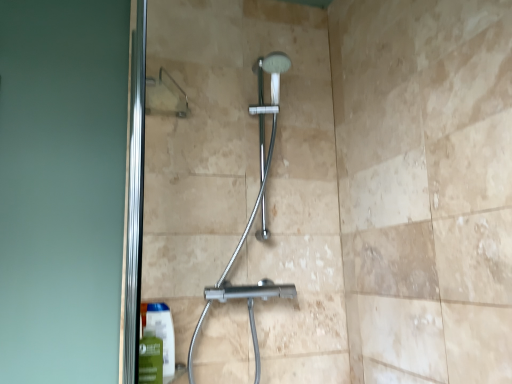
What do you see at coordinates (150, 358) in the screenshot? Image resolution: width=512 pixels, height=384 pixels. I see `green matte mouthwash at lower left` at bounding box center [150, 358].

Identify the location of transparent glass door at upper left. Image resolution: width=512 pixels, height=384 pixels. (246, 180).

Which of these two, green matte mouthwash at lower left or chrome metallic shower at center, stands taller?

chrome metallic shower at center.

From the image's perspective, which one is positioned higher, green matte mouthwash at lower left or chrome metallic shower at center?

From the image's view, chrome metallic shower at center is above.

Can we say green matte mouthwash at lower left lies outside chrome metallic shower at center?

Absolutely, green matte mouthwash at lower left is external to chrome metallic shower at center.

Considering the relative positions of green matte mouthwash at lower left and chrome metallic shower at center in the image provided, is green matte mouthwash at lower left to the left of chrome metallic shower at center from the viewer's perspective?

Indeed, green matte mouthwash at lower left is positioned on the left side of chrome metallic shower at center.

Is transparent glass door at upper left at the back of green matte mouthwash at lower left?

green matte mouthwash at lower left is not turned away from transparent glass door at upper left.

Considering the relative positions of green matte mouthwash at lower left and transparent glass door at upper left in the image provided, is green matte mouthwash at lower left in front of transparent glass door at upper left?

Yes, it is.

Considering the sizes of green matte mouthwash at lower left and transparent glass door at upper left in the image, is green matte mouthwash at lower left bigger or smaller than transparent glass door at upper left?

Considering their sizes, green matte mouthwash at lower left takes up less space than transparent glass door at upper left.

Can we say green matte mouthwash at lower left lies outside transparent glass door at upper left?

That's correct, green matte mouthwash at lower left is outside of transparent glass door at upper left.

Based on their positions, is transparent glass door at upper left located to the left or right of chrome metallic shower at center?

transparent glass door at upper left is positioned on chrome metallic shower at center's left side.

Is point (308, 226) closer to viewer compared to point (271, 61)?

No, (308, 226) is behind (271, 61).

From a real-world perspective, which is physically below, transparent glass door at upper left or chrome metallic shower at center?

In real-world perspective, chrome metallic shower at center is lower.

Is transparent glass door at upper left positioned with its back to chrome metallic shower at center?

Absolutely, transparent glass door at upper left is directed away from chrome metallic shower at center.

Based on the photo, is chrome metallic shower at center looking in the opposite direction of transparent glass door at upper left?

Yes, chrome metallic shower at center is facing away from transparent glass door at upper left.

Does chrome metallic shower at center have a lesser width compared to transparent glass door at upper left?

No, chrome metallic shower at center is not thinner than transparent glass door at upper left.

The height and width of the screenshot is (384, 512). Identify the location of glass door behind the chrome metallic shower at center. (246, 180).

Looking at this image, what's the angular difference between chrome metallic shower at center and transparent glass door at upper left's facing directions?

1.8 degrees separate the facing orientations of chrome metallic shower at center and transparent glass door at upper left.

Which is in front, transparent glass door at upper left or green matte mouthwash at lower left?

green matte mouthwash at lower left is in front.

Image resolution: width=512 pixels, height=384 pixels. What are the coordinates of `glass door that appears above the green matte mouthwash at lower left (from a real-world perspective)` in the screenshot? It's located at (246, 180).

From a real-world perspective, between transparent glass door at upper left and green matte mouthwash at lower left, who is vertically higher?

transparent glass door at upper left, from a real-world perspective.

Between transparent glass door at upper left and green matte mouthwash at lower left, which one has larger width?

green matte mouthwash at lower left.

Is point (261, 63) closer or farther from the camera than point (157, 351)?

Point (261, 63) is farther from the camera than point (157, 351).

Who is taller, chrome metallic shower at center or green matte mouthwash at lower left?

Standing taller between the two is chrome metallic shower at center.

Is chrome metallic shower at center smaller than green matte mouthwash at lower left?

No.

From a real-world perspective, between chrome metallic shower at center and green matte mouthwash at lower left, who is vertically lower?

In real-world perspective, green matte mouthwash at lower left is lower.

At what (x,y) coordinates should I click in order to perform the action: click on shower lying on the right of green matte mouthwash at lower left. Please return your answer as a coordinate pair (x, y). This screenshot has width=512, height=384. Looking at the image, I should click on (253, 215).

This screenshot has height=384, width=512. There is a green matte mouthwash at lower left. Find the location of `glass door above it (from a real-world perspective)`. glass door above it (from a real-world perspective) is located at coordinates (246, 180).

Based on their spatial positions, is transparent glass door at upper left or chrome metallic shower at center further from green matte mouthwash at lower left?

The object further to green matte mouthwash at lower left is transparent glass door at upper left.

Estimate the real-world distances between objects in this image. Which object is closer to transparent glass door at upper left, chrome metallic shower at center or green matte mouthwash at lower left?

chrome metallic shower at center is closer to transparent glass door at upper left.

Considering their positions, is green matte mouthwash at lower left positioned further to chrome metallic shower at center than transparent glass door at upper left?

green matte mouthwash at lower left lies further to chrome metallic shower at center than the other object.

Based on their spatial positions, is chrome metallic shower at center or transparent glass door at upper left closer to green matte mouthwash at lower left?

Based on the image, chrome metallic shower at center appears to be nearer to green matte mouthwash at lower left.

Which object lies further to the anchor point chrome metallic shower at center, transparent glass door at upper left or green matte mouthwash at lower left?

green matte mouthwash at lower left is positioned further to the anchor chrome metallic shower at center.

Estimate the real-world distances between objects in this image. Which object is closer to transparent glass door at upper left, green matte mouthwash at lower left or chrome metallic shower at center?

Based on the image, chrome metallic shower at center appears to be nearer to transparent glass door at upper left.

Image resolution: width=512 pixels, height=384 pixels. I want to click on shower between transparent glass door at upper left and green matte mouthwash at lower left in the up-down direction, so click(x=253, y=215).